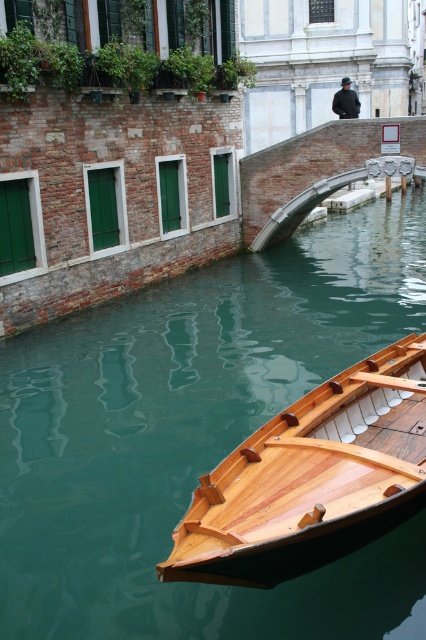
Question: Which object is closer to the camera taking this photo?

Choices:
 (A) green smooth water at lower left
 (B) shiny brown wood boat at lower right

Answer: (B)

Question: In this image, where is green smooth water at lower left located relative to shiny brown wood boat at lower right?

Choices:
 (A) above
 (B) below

Answer: (A)

Question: Is green smooth water at lower left smaller than shiny brown wood boat at lower right?

Choices:
 (A) yes
 (B) no

Answer: (B)

Question: Among these points, which one is nearest to the camera?

Choices:
 (A) (423, 221)
 (B) (412, 480)

Answer: (B)

Question: Is green smooth water at lower left to the left of shiny brown wood boat at lower right from the viewer's perspective?

Choices:
 (A) yes
 (B) no

Answer: (A)